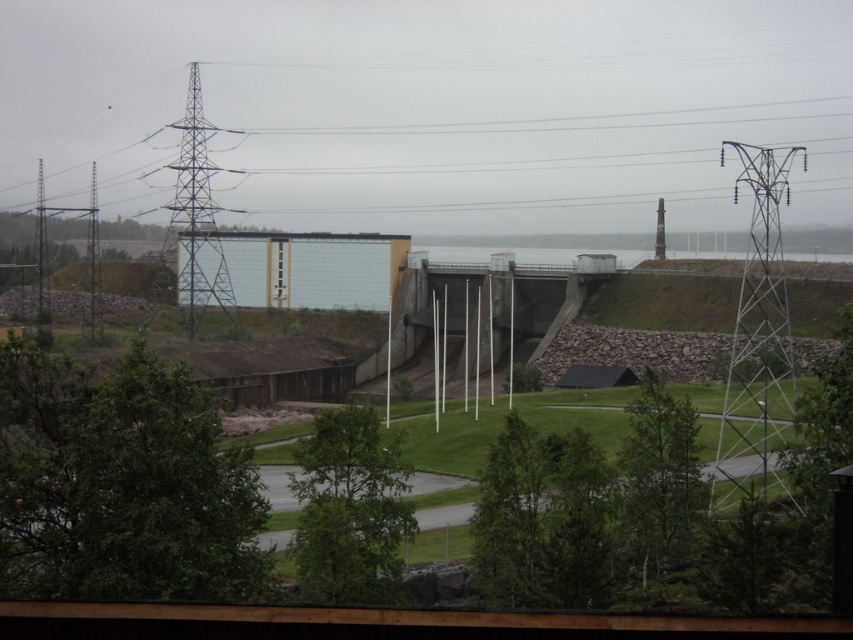
Question: Which of these objects is positioned farthest from the metallic silver tower at right?

Choices:
 (A) smooth concrete tower at upper right
 (B) metallic grid tower at left

Answer: (A)

Question: Is metallic silver tower at right wider than metallic grid tower at left?

Choices:
 (A) yes
 (B) no

Answer: (B)

Question: Which of the following is the farthest from the observer?

Choices:
 (A) (184, 243)
 (B) (654, 253)

Answer: (B)

Question: Can you confirm if metallic silver tower at right is positioned to the right of metallic grid tower at left?

Choices:
 (A) yes
 (B) no

Answer: (A)

Question: Which point is farther to the camera?

Choices:
 (A) metallic silver tower at right
 (B) metallic grid tower at left

Answer: (B)

Question: Does metallic grid tower at left appear on the right side of smooth concrete tower at upper right?

Choices:
 (A) yes
 (B) no

Answer: (B)